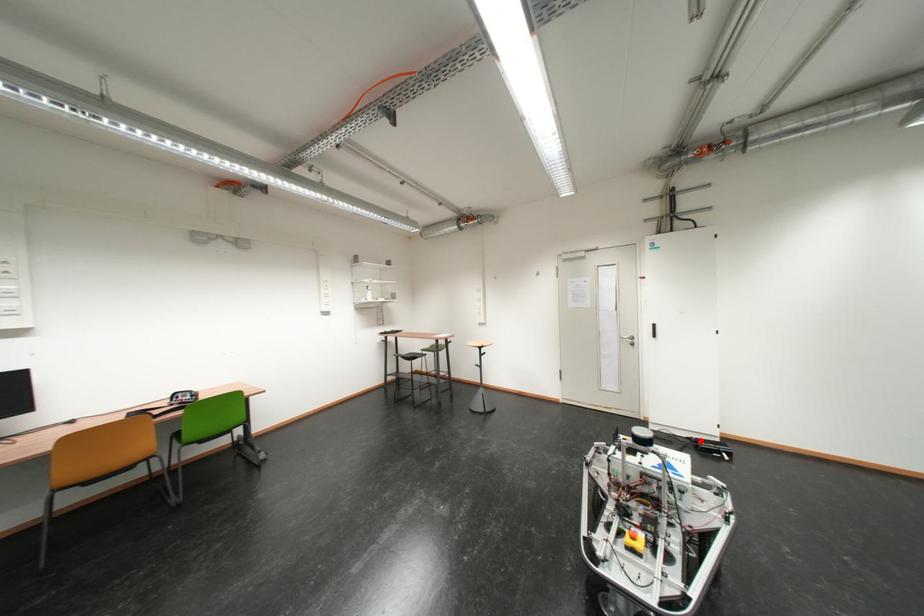
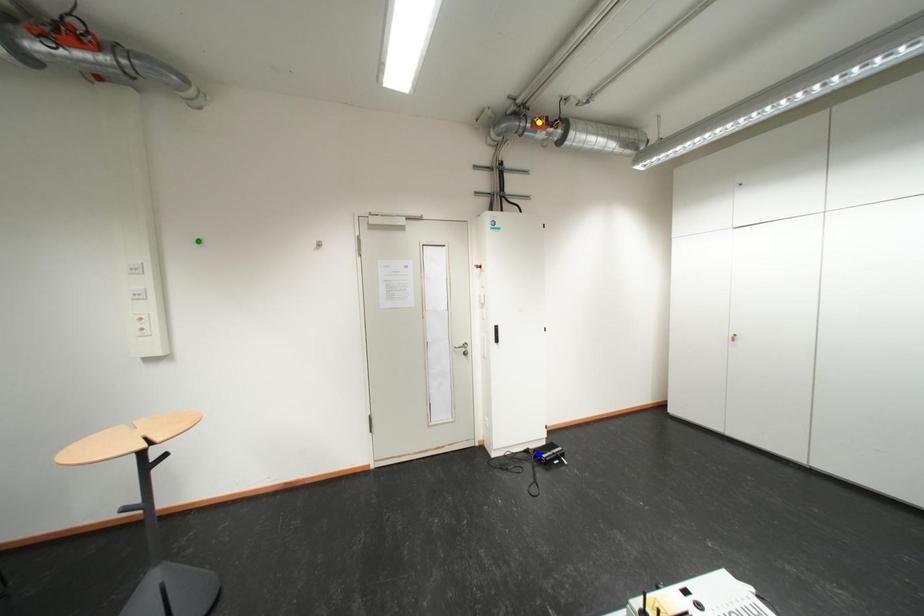
Question: I am providing you with two images of the same scene from different viewpoints. A red point is marked on the first image. You are given multiple points on the second image. Which spot in image 2 lines up with the point in image 1?

Choices:
 (A) blue point
 (B) yellow point
 (C) green point

Answer: (A)